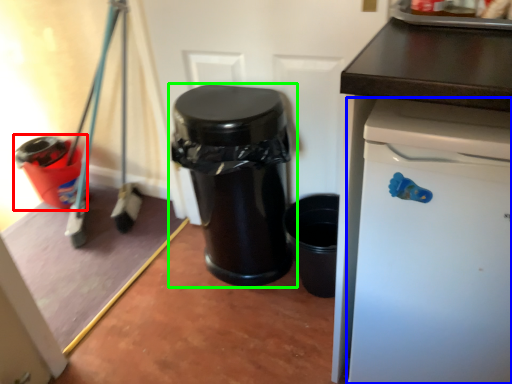
Question: Which object is the farthest from waste container (highlighted by a red box)? Choose among these: dish washer (highlighted by a blue box) or waste container (highlighted by a green box).

Choices:
 (A) dish washer
 (B) waste container

Answer: (A)